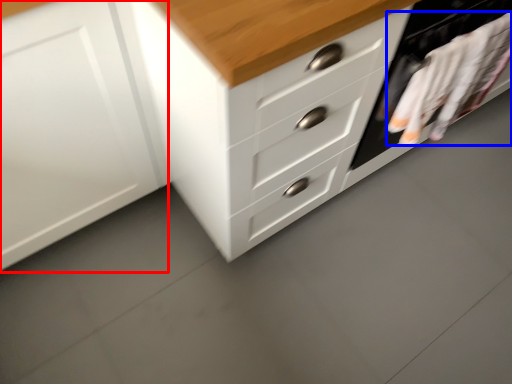
Question: Which object appears farthest to the camera in this image, cabinetry (highlighted by a red box) or laundry (highlighted by a blue box)?

Choices:
 (A) cabinetry
 (B) laundry

Answer: (B)